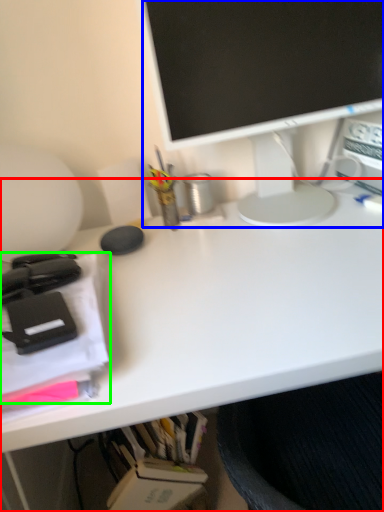
Question: Which object is positioned farthest from desk (highlighted by a red box)? Select from television (highlighted by a blue box) and office supplies (highlighted by a green box).

Choices:
 (A) television
 (B) office supplies

Answer: (A)